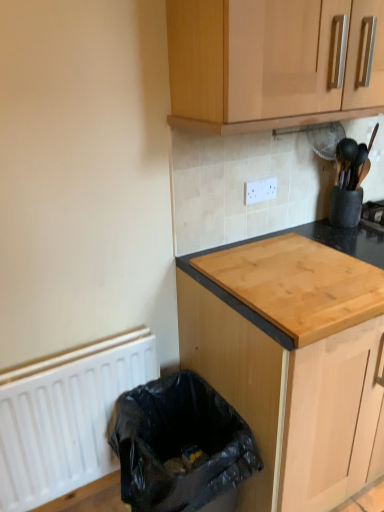
Question: From a real-world perspective, is natural wood cutting board at center, which appears as the 2th cabinetry when viewed from the top, beneath wooden cabinet at upper center, arranged as the 2th cabinetry when ordered from the bottom?

Choices:
 (A) no
 (B) yes

Answer: (B)

Question: From a real-world perspective, is natural wood cutting board at center, which appears as the 2th cabinetry when viewed from the top, physically above wooden cabinet at upper center, which is the 1th cabinetry in top-to-bottom order?

Choices:
 (A) no
 (B) yes

Answer: (A)

Question: Is natural wood cutting board at center, which is the first cabinetry from bottom to top, outside wooden cabinet at upper center, arranged as the 2th cabinetry when ordered from the bottom?

Choices:
 (A) no
 (B) yes

Answer: (B)

Question: Is natural wood cutting board at center, which is the first cabinetry from bottom to top, behind wooden cabinet at upper center, which is the 1th cabinetry in top-to-bottom order?

Choices:
 (A) no
 (B) yes

Answer: (B)

Question: Does natural wood cutting board at center, which is the first cabinetry from bottom to top, have a lesser height compared to wooden cabinet at upper center, arranged as the 2th cabinetry when ordered from the bottom?

Choices:
 (A) no
 (B) yes

Answer: (A)

Question: Is wooden cabinet at upper center, which is the 1th cabinetry in top-to-bottom order, located within natural wood cutting board at center, which appears as the 2th cabinetry when viewed from the top?

Choices:
 (A) no
 (B) yes

Answer: (A)

Question: Can natural wood countertop at center be found inside natural wood cutting board at center, which appears as the 2th cabinetry when viewed from the top?

Choices:
 (A) no
 (B) yes

Answer: (B)

Question: Are natural wood cutting board at center, which is the first cabinetry from bottom to top, and natural wood countertop at center making contact?

Choices:
 (A) no
 (B) yes

Answer: (A)

Question: Does natural wood cutting board at center, which appears as the 2th cabinetry when viewed from the top, have a lesser width compared to natural wood countertop at center?

Choices:
 (A) no
 (B) yes

Answer: (A)

Question: Could you tell me if natural wood cutting board at center, which is the first cabinetry from bottom to top, is turned towards natural wood countertop at center?

Choices:
 (A) no
 (B) yes

Answer: (A)

Question: Does natural wood cutting board at center, which is the first cabinetry from bottom to top, have a smaller size compared to natural wood countertop at center?

Choices:
 (A) no
 (B) yes

Answer: (A)

Question: Is natural wood countertop at center at the back of natural wood cutting board at center, which appears as the 2th cabinetry when viewed from the top?

Choices:
 (A) yes
 (B) no

Answer: (B)

Question: Is wooden cabinet at upper center, arranged as the 2th cabinetry when ordered from the bottom, aimed at natural wood cutting board at center, which appears as the 2th cabinetry when viewed from the top?

Choices:
 (A) yes
 (B) no

Answer: (B)